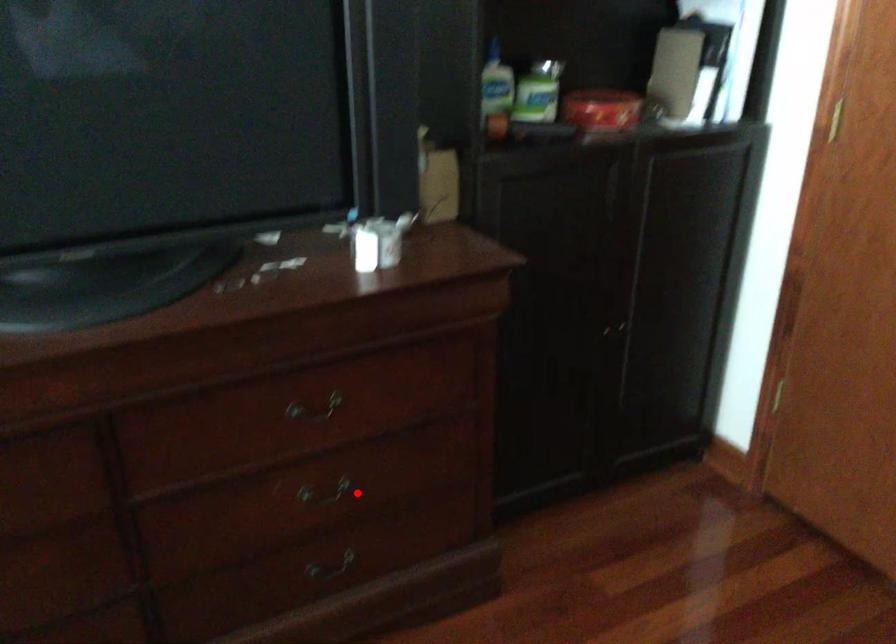
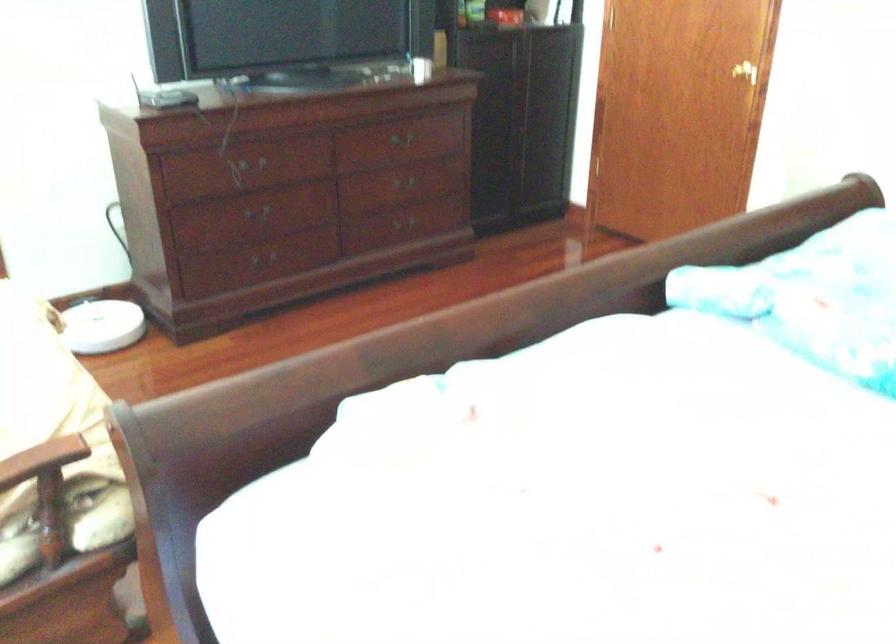
Question: A red point is marked in image1. In image2, is the corresponding 3D point closer to the camera or farther? Reply with the corresponding letter.

Choices:
 (A) The corresponding 3D point is closer.
 (B) The corresponding 3D point is farther.

Answer: (B)